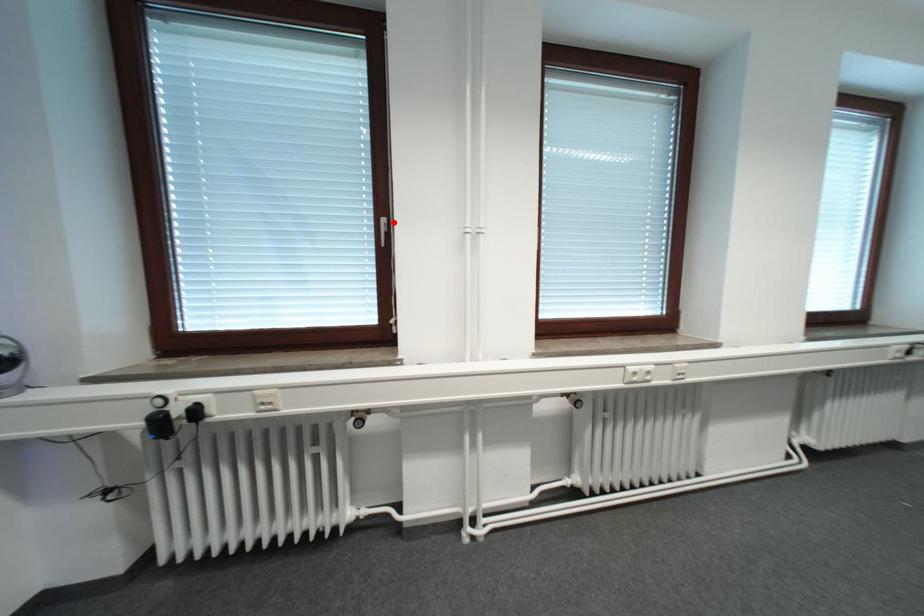
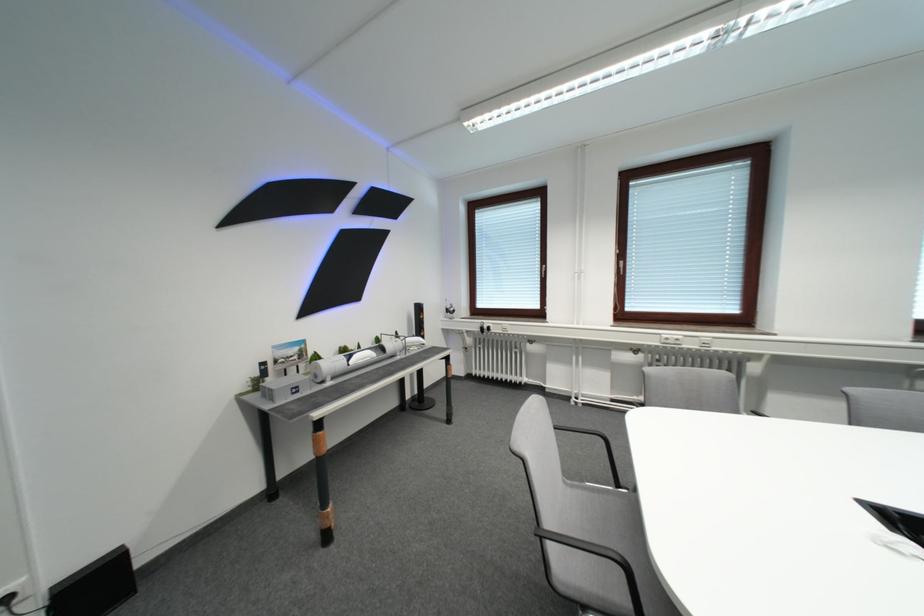
Find the pixel in the second image that matches the highlighted location in the first image.

(553, 269)